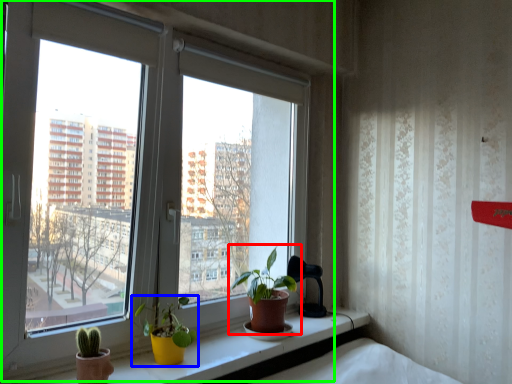
Question: Which object is the closest to the houseplant (highlighted by a red box)? Choose among these: houseplant (highlighted by a blue box) or window (highlighted by a green box).

Choices:
 (A) houseplant
 (B) window

Answer: (A)